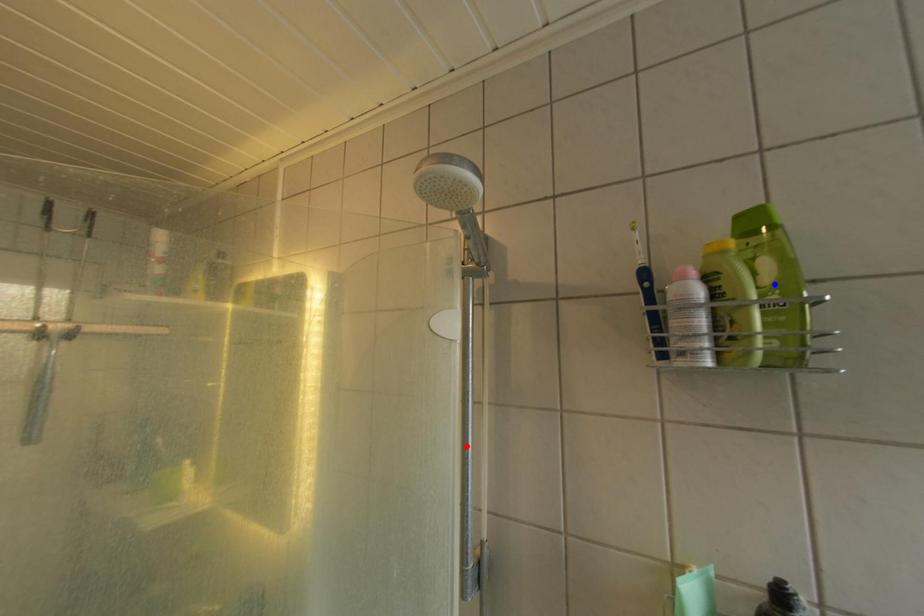
Question: Two points are marked on the image. Which point is closer to the camera?

Choices:
 (A) Blue point is closer.
 (B) Red point is closer.

Answer: (A)